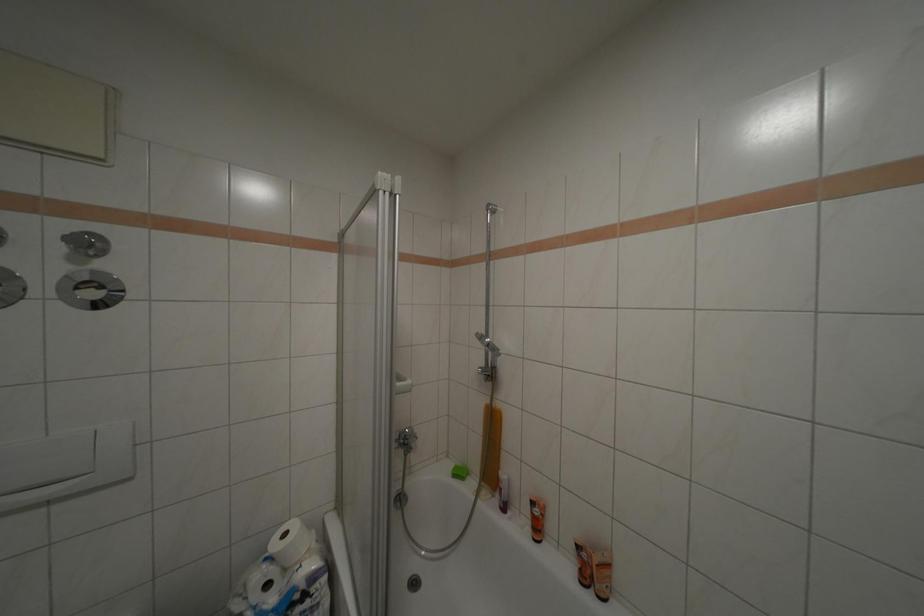
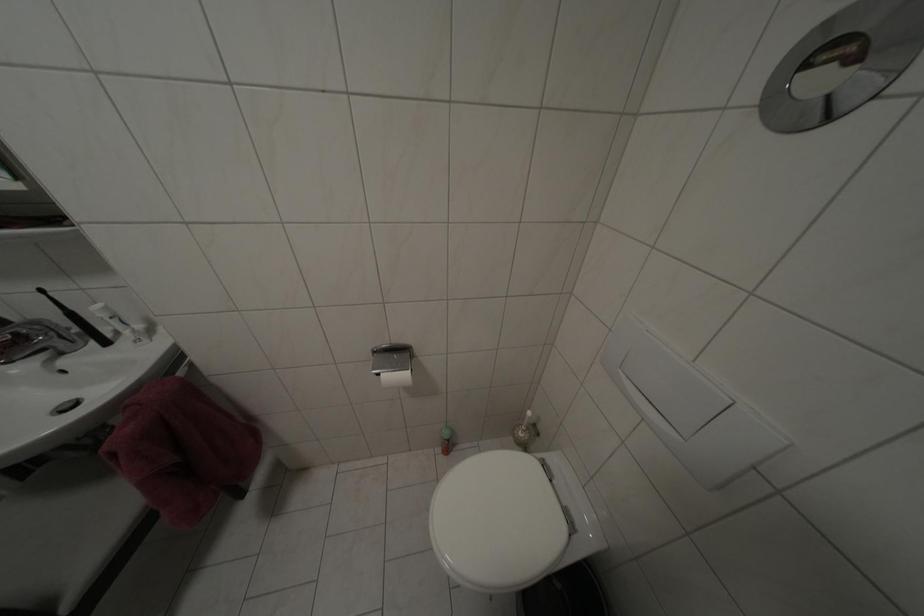
First-person continuous shooting, in which direction is the camera rotating?

The camera's rotation is toward left-down.